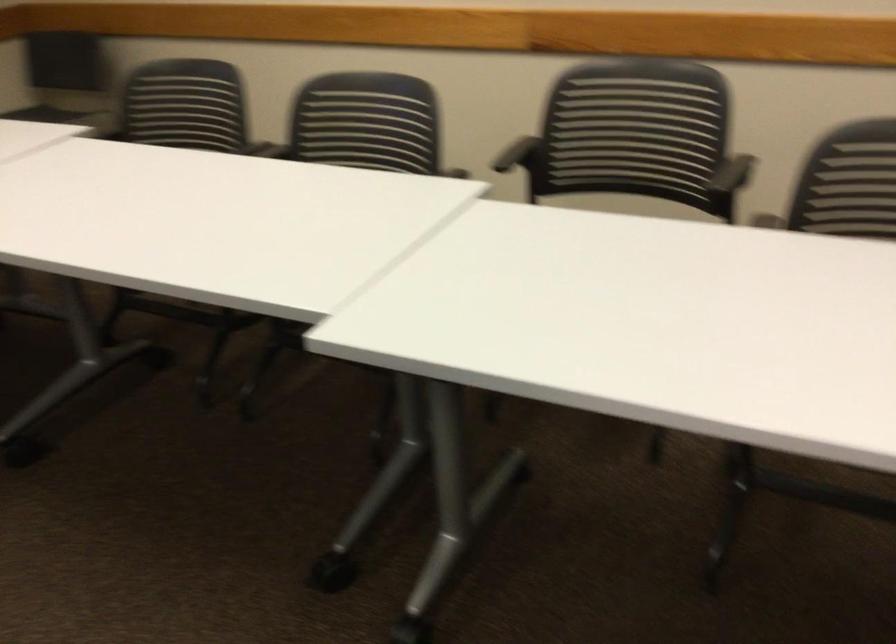
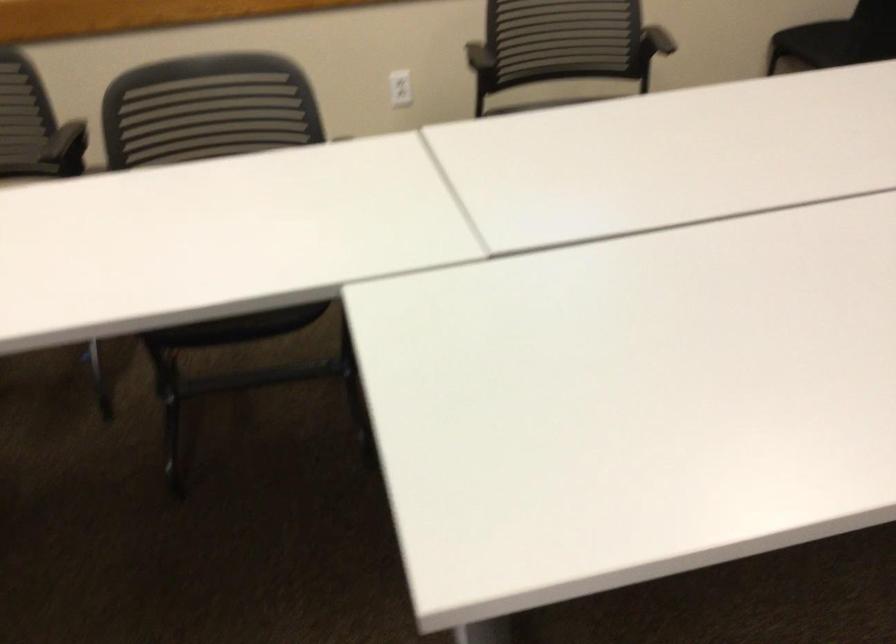
Question: The first image is from the beginning of the video and the second image is from the end. How did the camera likely rotate when shooting the video?

Choices:
 (A) Left
 (B) Right
 (C) Up
 (D) Down

Answer: (B)